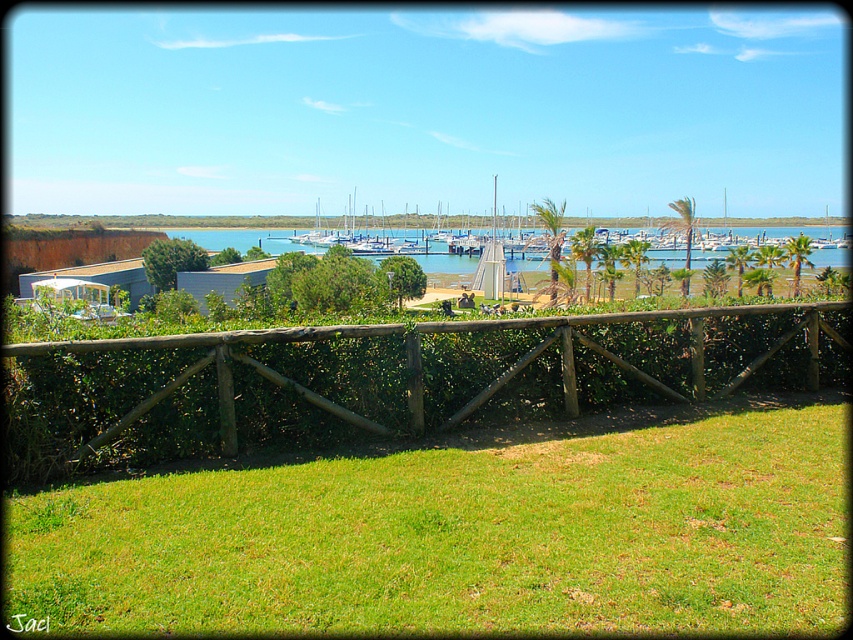
You are standing on the paved path near the center of the image and want to walk towards the marina. Which object, the brown wooden fence at center or the green leafy hedge at center, is on your right as you face the marina?

The brown wooden fence at center is positioned on the right side of green leafy hedge at center, so as you face the marina, the brown wooden fence at center will be on your right.

You are standing in the coastal scene and want to take a photo of the green leafy hedge at center without the brown wooden fence at center blocking the view. Which direction should you move to ensure the hedge is visible without the fence?

The brown wooden fence at center is closer to the viewer than the green leafy hedge at center. To avoid the fence blocking the view of the hedge, you should move to the side of the fence so that the hedge comes into view beyond it.